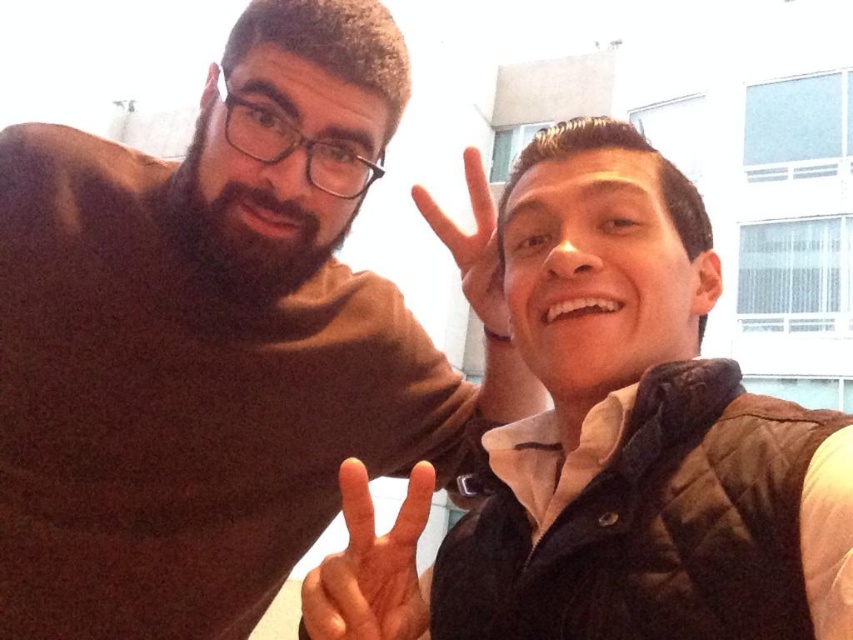
Question: Which point is closer to the camera?

Choices:
 (A) brown quilted vest at right
 (B) brown matte shirt at left

Answer: (A)

Question: In this image, where is brown matte shirt at left located relative to light skin tone flesh at center?

Choices:
 (A) left
 (B) right

Answer: (A)

Question: Can you confirm if brown matte shirt at left is positioned to the right of light skin tone flesh at center?

Choices:
 (A) no
 (B) yes

Answer: (A)

Question: Among these points, which one is nearest to the camera?

Choices:
 (A) (473, 300)
 (B) (352, 92)
 (C) (454, 593)

Answer: (C)

Question: Is brown matte shirt at left to the right of light skin tone flesh at center from the viewer's perspective?

Choices:
 (A) yes
 (B) no

Answer: (B)

Question: Estimate the real-world distances between objects in this image. Which object is closer to the light skin tone flesh at center?

Choices:
 (A) matte black hand at center
 (B) brown matte shirt at left

Answer: (B)